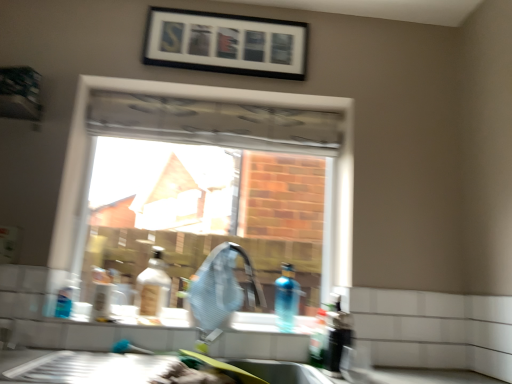
This screenshot has width=512, height=384. Identify the location of free space above black matte picture frame at upper center (from a real-world perspective). (233, 9).